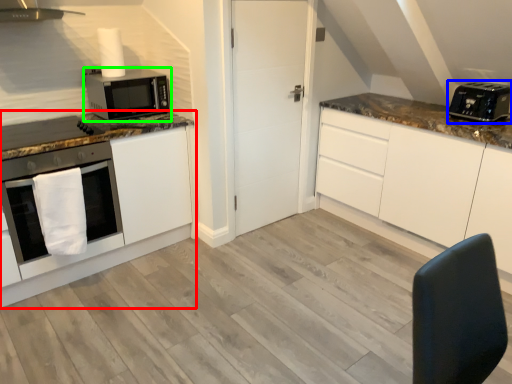
Question: Estimate the real-world distances between objects in this image. Which object is farther from cabinetry (highlighted by a red box), toaster (highlighted by a blue box) or microwave oven (highlighted by a green box)?

Choices:
 (A) toaster
 (B) microwave oven

Answer: (A)